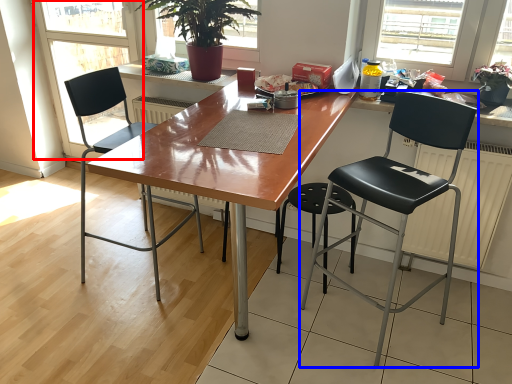
Question: Which object is closer to the camera taking this photo, screen door (highlighted by a red box) or chair (highlighted by a blue box)?

Choices:
 (A) screen door
 (B) chair

Answer: (B)